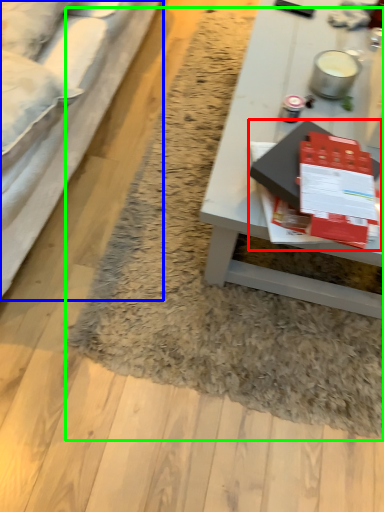
Question: Which object is positioned closest to magazine (highlighted by a red box)? Select from studio couch (highlighted by a blue box) and mat (highlighted by a green box).

Choices:
 (A) studio couch
 (B) mat

Answer: (B)